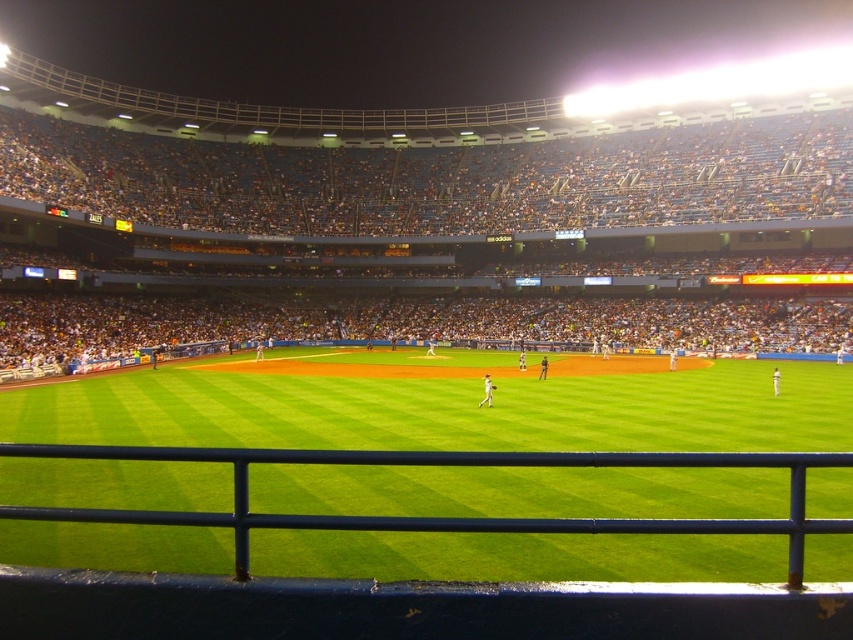
Can you confirm if green grass at lower center is taller than white matte uniform at center?

Yes.

Which is behind, point (671, 476) or point (483, 397)?

The point (483, 397) is behind.

This screenshot has width=853, height=640. Describe the element at coordinates (444, 404) in the screenshot. I see `green grass at lower center` at that location.

Where is `green grass at lower center`? This screenshot has height=640, width=853. green grass at lower center is located at coordinates (444, 404).